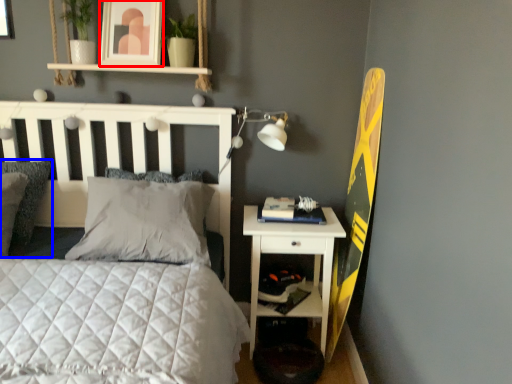
Question: Which point is further to the camera, picture frame (highlighted by a red box) or pillow (highlighted by a blue box)?

Choices:
 (A) picture frame
 (B) pillow

Answer: (A)